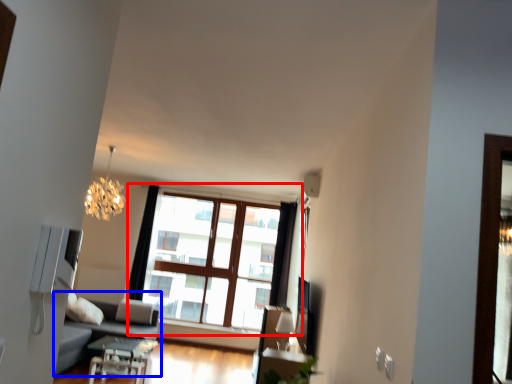
Question: Which object appears farthest to the camera in this image, window (highlighted by a red box) or studio couch (highlighted by a blue box)?

Choices:
 (A) window
 (B) studio couch

Answer: (A)